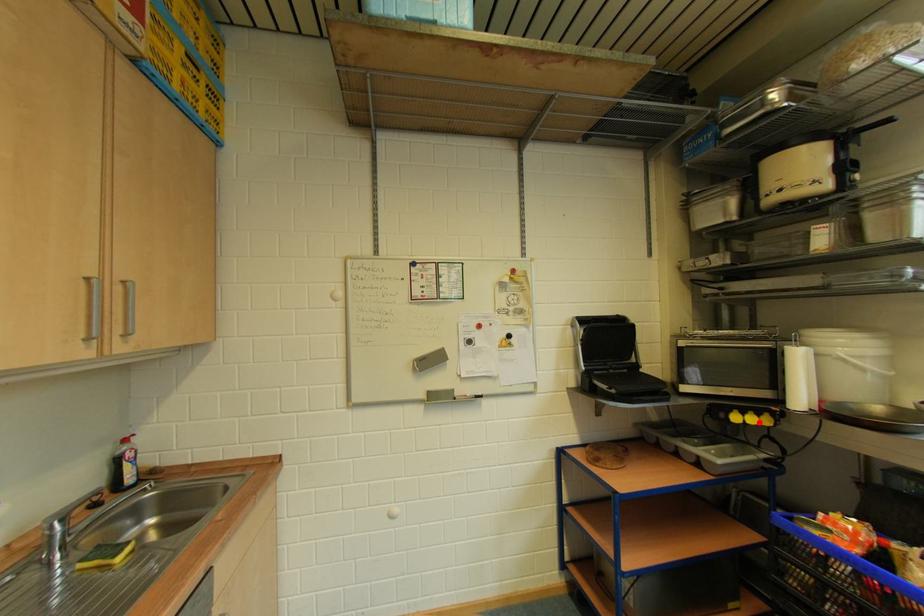
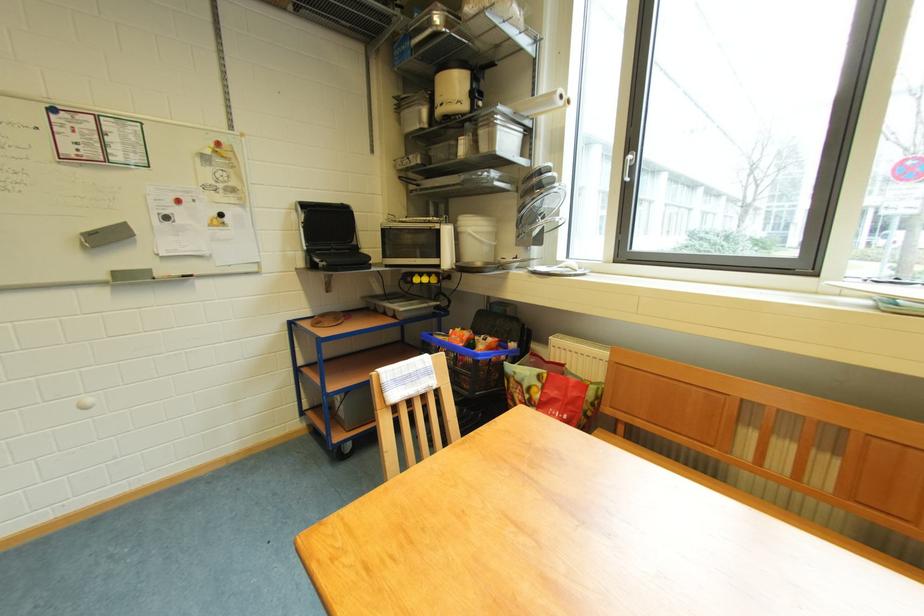
In the second image, find the point that corresponds to the highlighted location in the first image.

(432, 283)